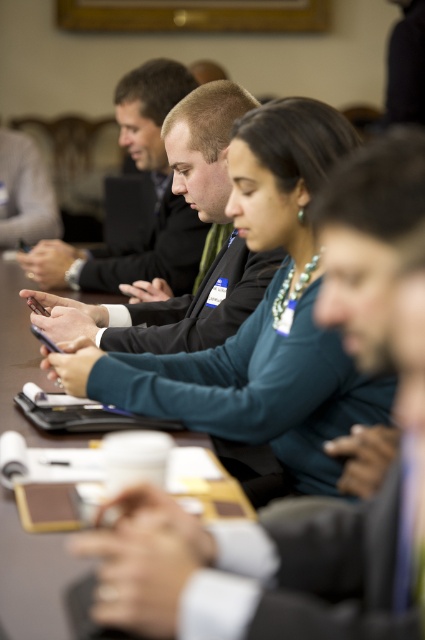
You are a photographer positioned at the end of the table. You want to capture a closeup shot of both the teal fabric shirt at center and the matte black suit at center in the same frame. Given that your camera has a minimum focus distance of 30 centimeters, can you achieve this without moving closer?

The teal fabric shirt at center and matte black suit at center are 40.30 centimeters apart. Since the distance between them is greater than the camera minimum focus distance of 30 centimeters, you can capture both in the same frame without moving closer.

You are standing at the entrance of the meeting room and want to locate the person wearing the matte black suit at center. According to the coordinates provided, where should you look in the image?

The matte black suit at center is located at the 2D coordinates point (203, 252) in the image.

You are sitting at the table and want to reach both the point at (223, 225) and the point at (36, 346). Which point is closer to you?

The point at (36, 346) is closer to you because it is in front of the point at (223, 225).